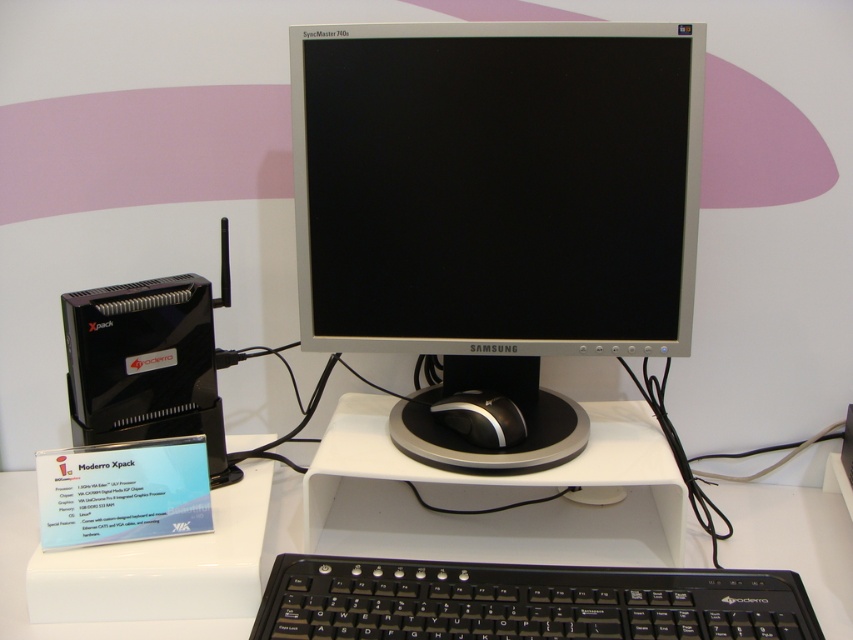
Who is shorter, white plastic computer desk at center or black glossy mouse at center?

Standing shorter between the two is black glossy mouse at center.

From the picture: Who is more forward, (704, 552) or (450, 422)?

Point (704, 552) is more forward.

What are the coordinates of `white plastic computer desk at center` in the screenshot? It's located at (793, 541).

Which of these two, white plastic computer desk at center or black plastic modero xpack at left, stands taller?

Standing taller between the two is black plastic modero xpack at left.

In order to click on white plastic computer desk at center in this screenshot , I will do `click(793, 541)`.

The width and height of the screenshot is (853, 640). I want to click on white plastic computer desk at center, so click(x=793, y=541).

Can you confirm if black plastic keyboard at lower center is smaller than white plastic computer desk at center?

Indeed, black plastic keyboard at lower center has a smaller size compared to white plastic computer desk at center.

Can you confirm if black plastic keyboard at lower center is taller than white plastic computer desk at center?

In fact, black plastic keyboard at lower center may be shorter than white plastic computer desk at center.

This screenshot has width=853, height=640. In order to click on black plastic keyboard at lower center in this screenshot , I will do `click(525, 602)`.